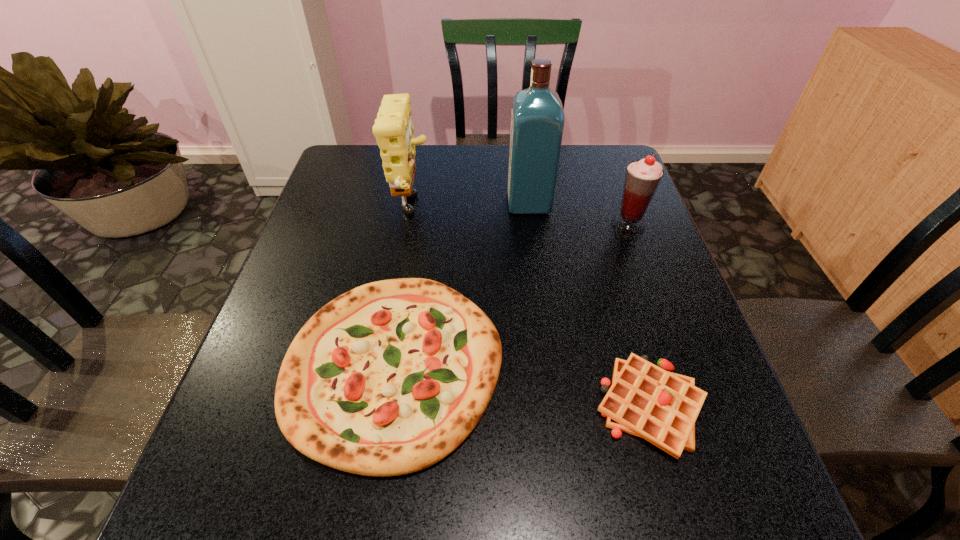
This screenshot has height=540, width=960. I want to click on free space at the near edge of the desktop, so click(580, 478).

Find the location of a particular element. The height and width of the screenshot is (540, 960). free space at the left edge of the desktop is located at coordinates (249, 417).

This screenshot has height=540, width=960. Find the location of `free space at the right edge of the desktop`. free space at the right edge of the desktop is located at coordinates (659, 335).

I want to click on vacant space at the far left corner of the desktop, so click(x=338, y=154).

The width and height of the screenshot is (960, 540). I want to click on vacant area at the far right corner of the desktop, so click(606, 155).

What are the coordinates of `free space that is in between the smoothie and the waffle` in the screenshot? It's located at (639, 316).

The height and width of the screenshot is (540, 960). Identify the location of vacant space that's between the second tallest object and the smoothie. (520, 218).

Identify the location of empty space between the smoothie and the pizza. (512, 295).

You are a GUI agent. You are given a task and a screenshot of the screen. Output one action in this format:
    pyautogui.click(x=<x>, y=<y>)
    Task: Click on the free space between the third object from right to left and the smoothie
    
    Given the screenshot: What is the action you would take?
    pyautogui.click(x=579, y=214)

At what (x,y) coordinates should I click in order to perform the action: click on vacant space in between the tallest object and the second tallest object. Please return your answer as a coordinate pair (x, y). This screenshot has height=540, width=960. Looking at the image, I should click on (470, 207).